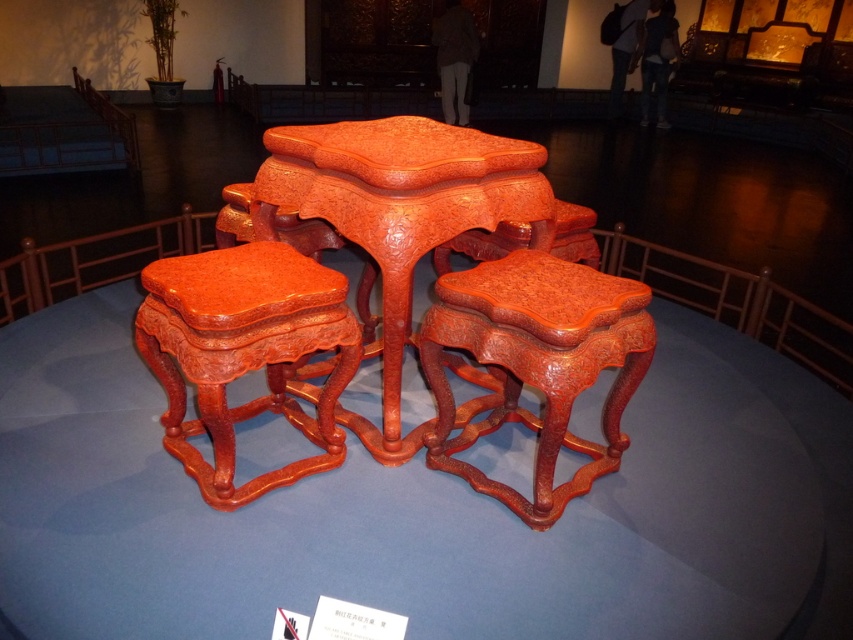
Question: In this image, where is cinnabar lacquer stool at center located relative to glossy lacquered stool at center?

Choices:
 (A) right
 (B) left

Answer: (A)

Question: Which of the following is the closest to the observer?

Choices:
 (A) (468, 275)
 (B) (270, 307)

Answer: (B)

Question: Which point appears closest to the camera in this image?

Choices:
 (A) (558, 403)
 (B) (299, 426)
 (C) (492, 147)

Answer: (A)

Question: Does cinnabar lacquer stool at center appear on the right side of glossy lacquered stool at center?

Choices:
 (A) no
 (B) yes

Answer: (B)

Question: Which is farther from the glossy lacquered stool at center?

Choices:
 (A) cinnabar lacquer stool at center
 (B) cinnabar lacquer table at center

Answer: (A)

Question: Can you confirm if cinnabar lacquer stool at center is bigger than glossy lacquered stool at center?

Choices:
 (A) no
 (B) yes

Answer: (B)